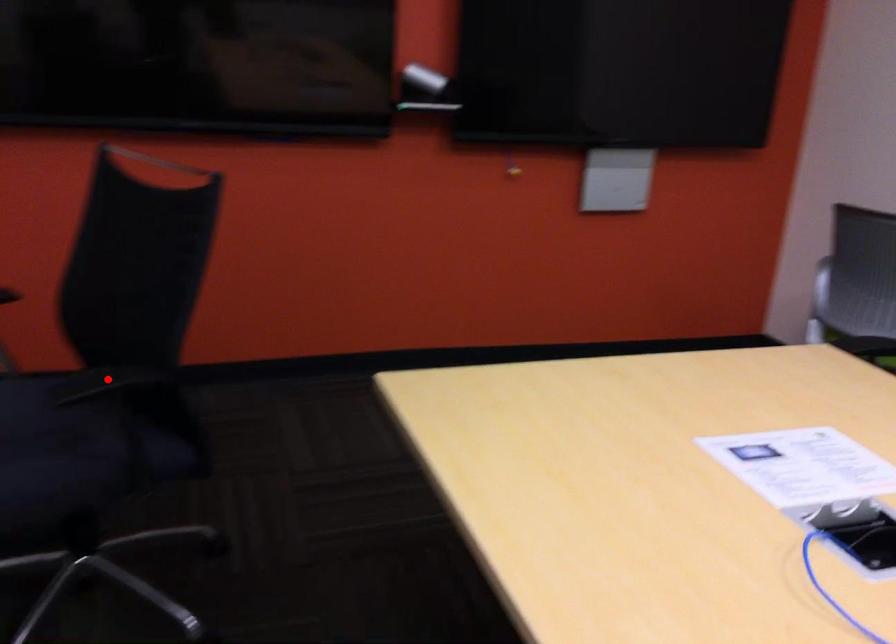
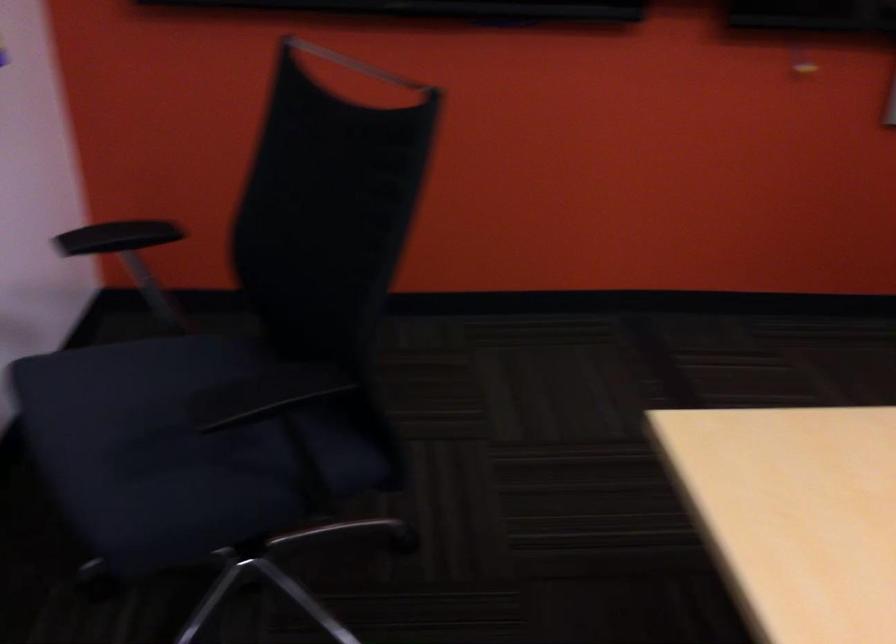
Question: I am providing you with two images of the same scene from different viewpoints. In image1, a red point is highlighted. Considering the same 3D point in image2, which of the following is correct?

Choices:
 (A) It is closer
 (B) It is farther

Answer: (A)